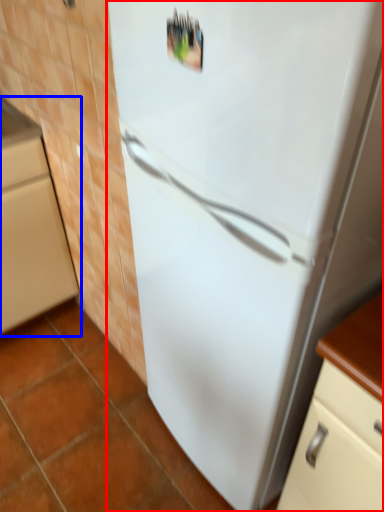
Question: Among these objects, which one is nearest to the camera, refrigerator (highlighted by a red box) or cabinetry (highlighted by a blue box)?

Choices:
 (A) refrigerator
 (B) cabinetry

Answer: (A)